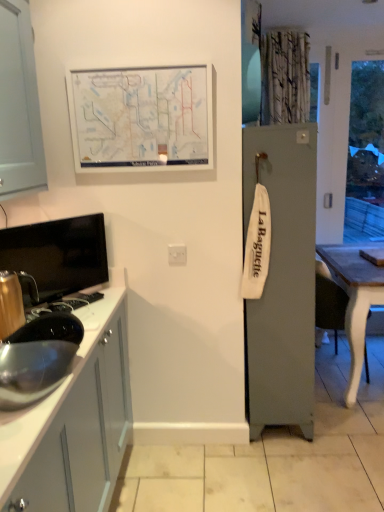
This screenshot has width=384, height=512. Identify the location of free space above white matte map at upper center (from a real-world perspective). (140, 62).